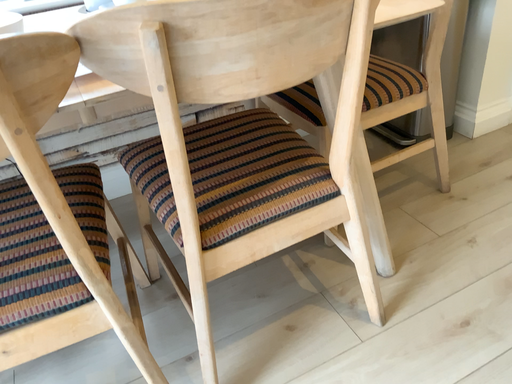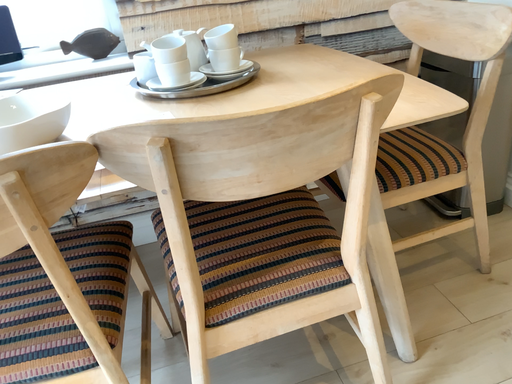
Question: How did the camera likely rotate when shooting the video?

Choices:
 (A) rotated left
 (B) rotated right

Answer: (A)